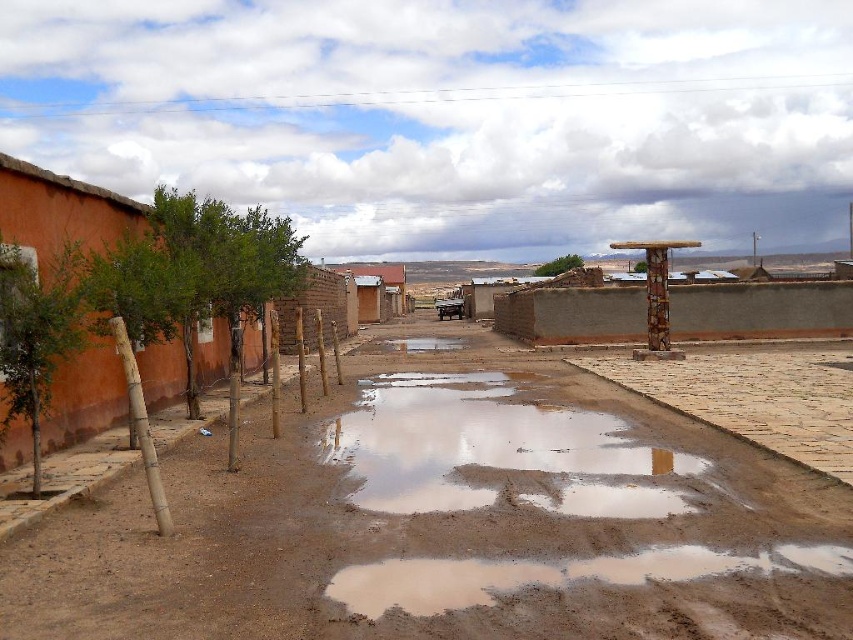
Question: Which object appears closest to the camera in this image?

Choices:
 (A) transparent mud water at center
 (B) brown dirt at center

Answer: (B)

Question: Considering the relative positions of brown dirt at center and transparent mud water at center in the image provided, where is brown dirt at center located with respect to transparent mud water at center?

Choices:
 (A) below
 (B) above

Answer: (B)

Question: Observing the image, what is the correct spatial positioning of brown dirt at center in reference to transparent mud water at center?

Choices:
 (A) above
 (B) below

Answer: (A)

Question: Does brown dirt at center come in front of transparent mud water at center?

Choices:
 (A) no
 (B) yes

Answer: (B)

Question: Which point appears closest to the camera in this image?

Choices:
 (A) (480, 433)
 (B) (508, 564)

Answer: (B)